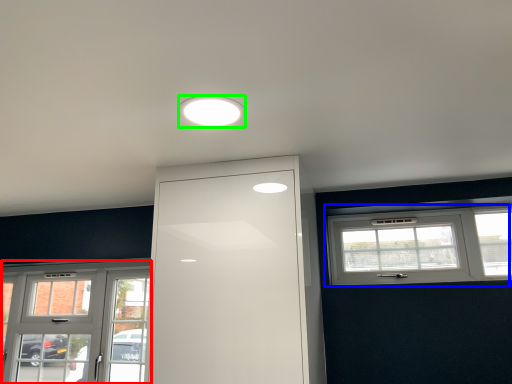
Question: Based on their relative distances, which object is farther from window (highlighted by a red box)? Choose from window (highlighted by a blue box) and lighting (highlighted by a green box).

Choices:
 (A) window
 (B) lighting

Answer: (B)